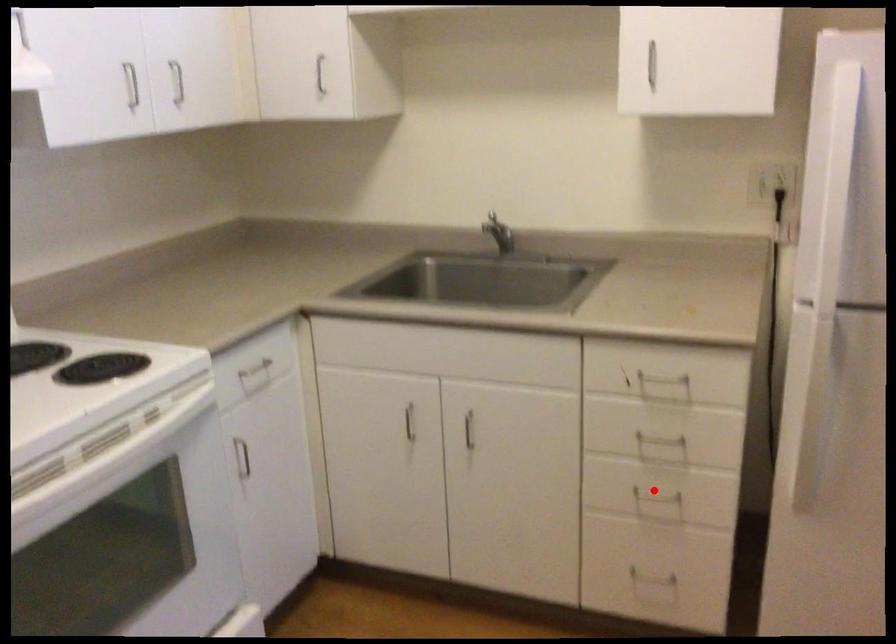
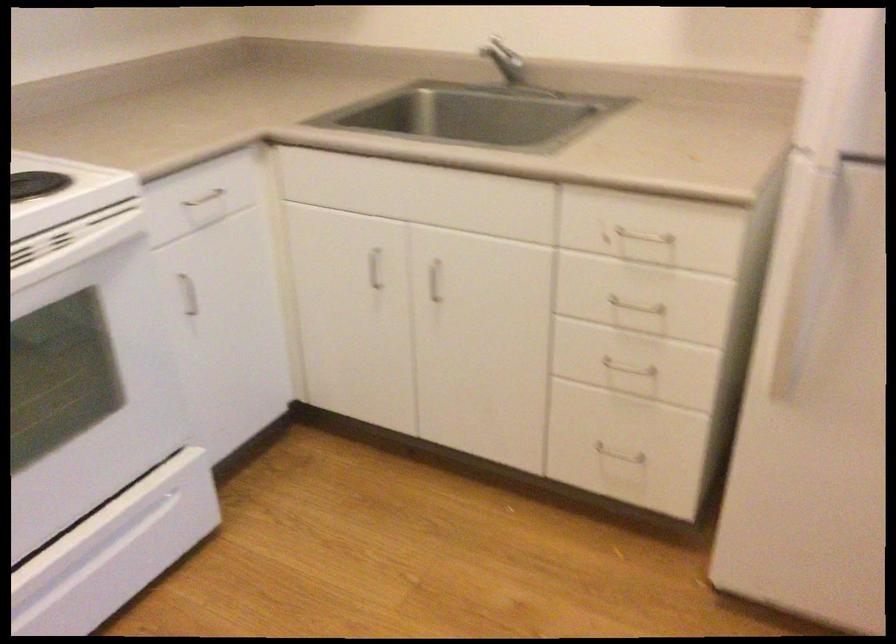
Question: I am providing you with two images of the same scene from different viewpoints. In image1, a red point is highlighted. Considering the same 3D point in image2, which of the following is correct?

Choices:
 (A) It is closer
 (B) It is farther

Answer: (A)